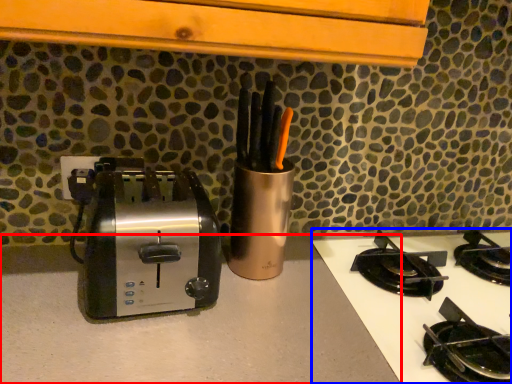
Question: Which object is closer to the camera taking this photo, counter top (highlighted by a red box) or gas stove (highlighted by a blue box)?

Choices:
 (A) counter top
 (B) gas stove

Answer: (A)